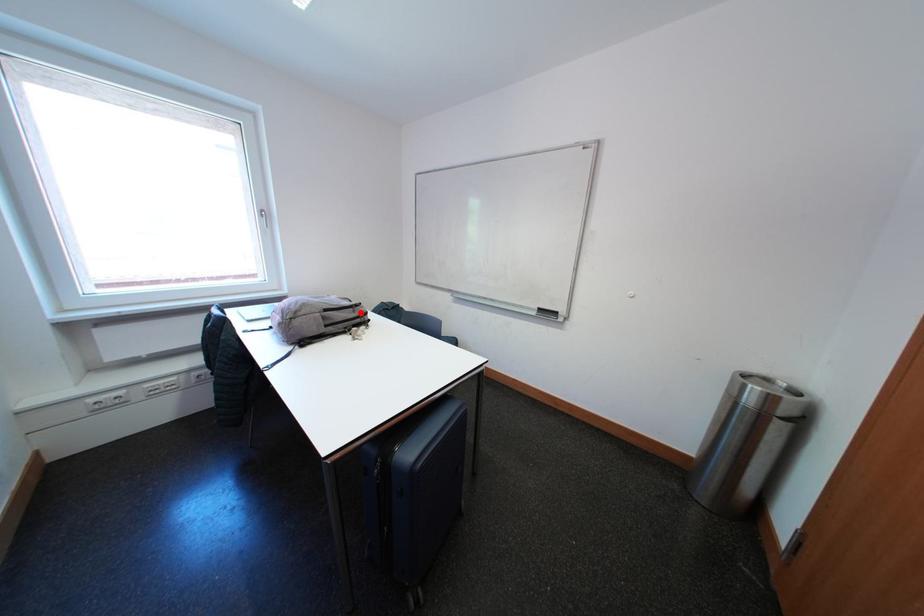
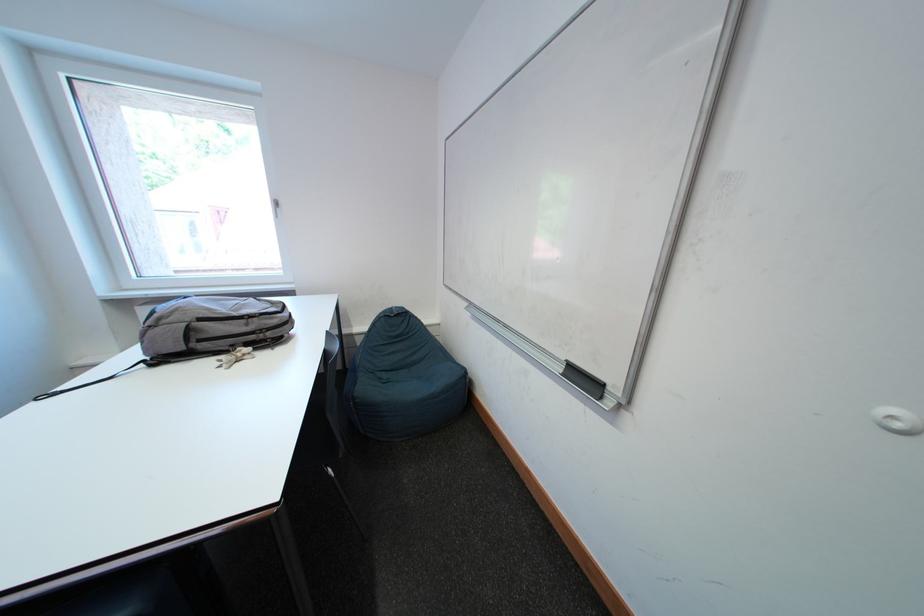
Question: A red point is marked in image1. In image2, is the corresponding 3D point closer to the camera or farther? Reply with the corresponding letter.

Choices:
 (A) The corresponding 3D point is closer.
 (B) The corresponding 3D point is farther.

Answer: (B)